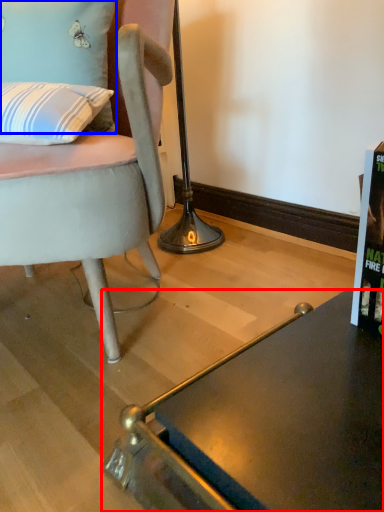
Question: Which object appears farthest to the camera in this image, desk (highlighted by a red box) or pillow (highlighted by a blue box)?

Choices:
 (A) desk
 (B) pillow

Answer: (B)